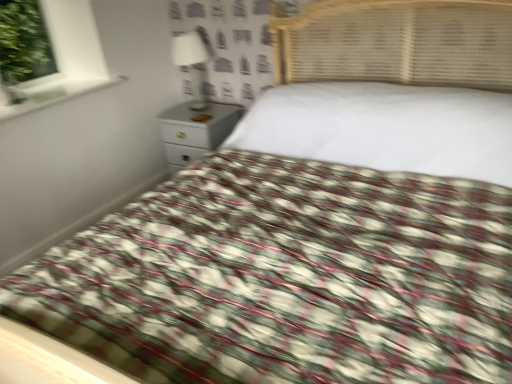
Question: Choose the correct answer: Is white glossy lamp at upper center inside white glossy nightstand at upper center or outside it?

Choices:
 (A) inside
 (B) outside

Answer: (B)

Question: In terms of size, does white glossy lamp at upper center appear bigger or smaller than white glossy nightstand at upper center?

Choices:
 (A) small
 (B) big

Answer: (A)

Question: Which of these objects is positioned closest to the white glossy window sill at upper left?

Choices:
 (A) white glossy nightstand at upper center
 (B) white glossy lamp at upper center

Answer: (A)

Question: Which object is the closest to the white glossy window sill at upper left?

Choices:
 (A) white glossy nightstand at upper center
 (B) white glossy lamp at upper center

Answer: (A)